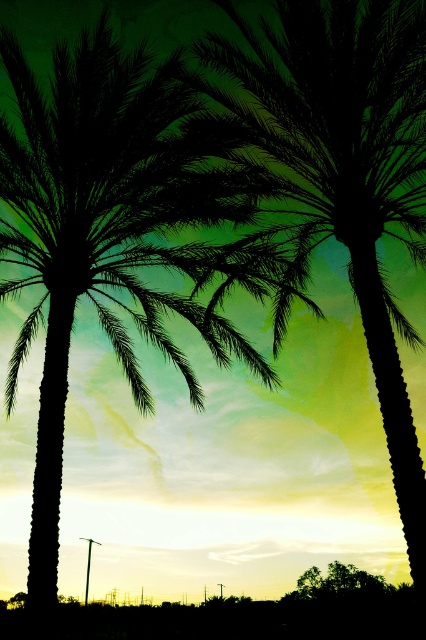
You are standing in front of the two trees in the image. Which tree would appear larger to you, the silhouette palm tree at center or the silhouette leafy tree at lower center?

The silhouette palm tree at center appears larger because it is closer to the viewer than the silhouette leafy tree at lower center.